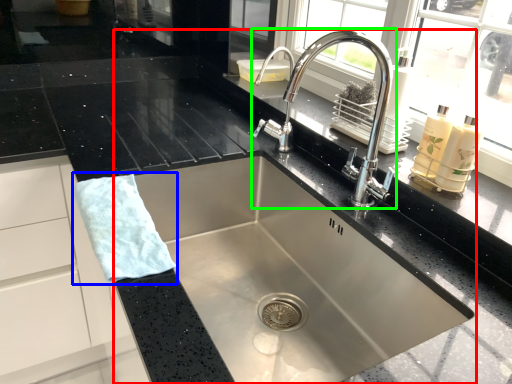
Question: Based on their relative distances, which object is nearer to sink (highlighted by a red box)? Choose from hand towel (highlighted by a blue box) and tap (highlighted by a green box).

Choices:
 (A) hand towel
 (B) tap

Answer: (B)